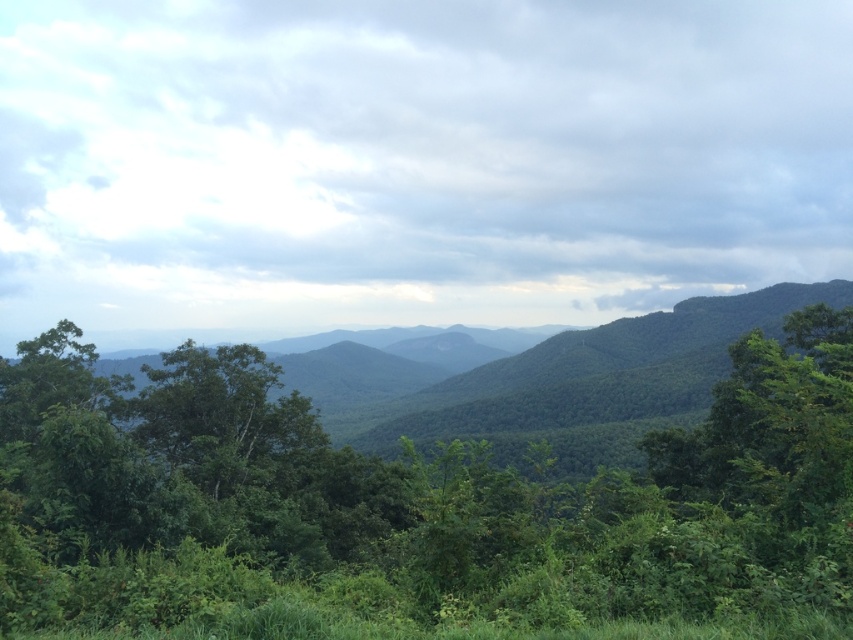
Which is behind, point (331, 616) or point (190, 444)?

The point (190, 444) is behind.

Does point (146, 612) lie in front of point (258, 397)?

Yes, it is in front of point (258, 397).

Measure the distance between point (x=532, y=580) and camera.

21.38 feet

You are a GUI agent. You are given a task and a screenshot of the screen. Output one action in this format:
    pyautogui.click(x=<x>, y=<y>)
    Task: Click on the green leafy forest at center
    The image size is (853, 640).
    Given the screenshot: What is the action you would take?
    pyautogui.click(x=433, y=490)